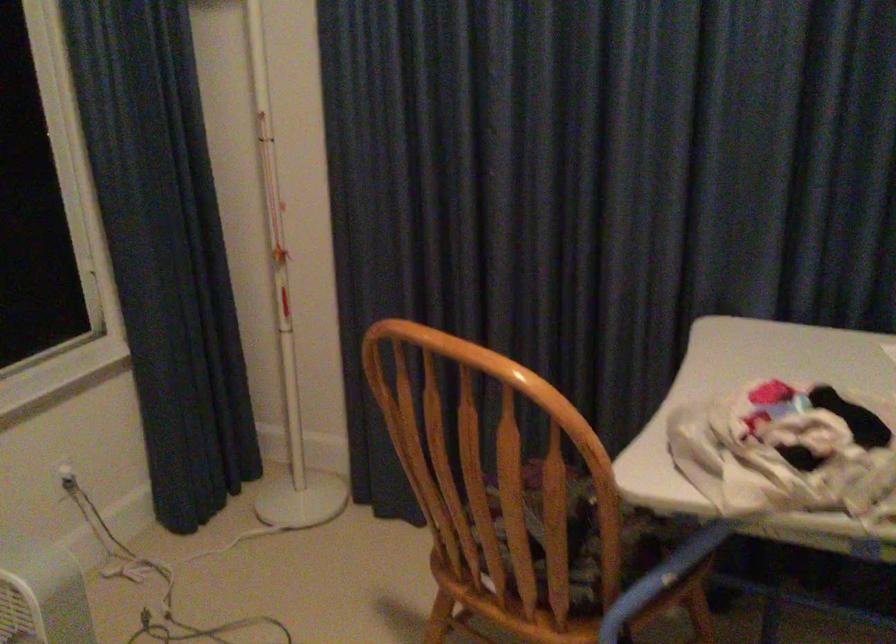
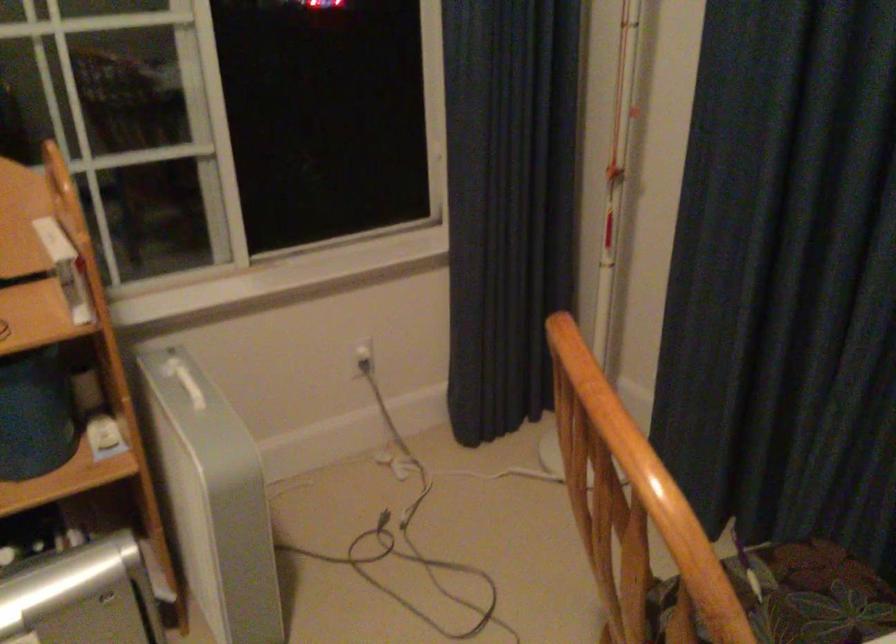
Question: The first image is from the beginning of the video and the second image is from the end. How did the camera likely rotate when shooting the video?

Choices:
 (A) Left
 (B) Right
 (C) Up
 (D) Down

Answer: (A)